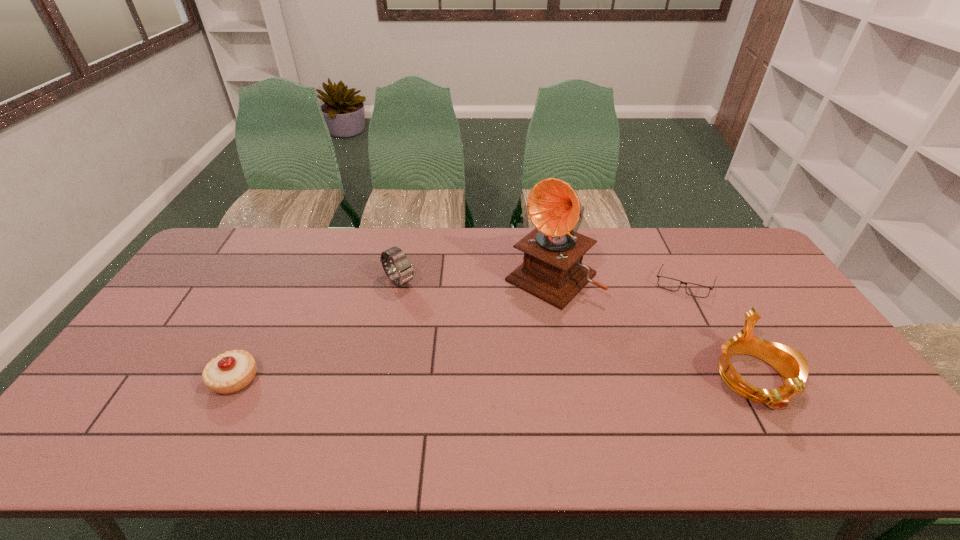
In order to click on vacant space on the desktop that is between the second shortest object and the tiara and is positioned on the horn of the phonograph record in this screenshot , I will do `click(444, 379)`.

Where is `free spot on the desktop that is between the pastry and the tiara and is positioned with the lenses facing outward on the spectacles`? free spot on the desktop that is between the pastry and the tiara and is positioned with the lenses facing outward on the spectacles is located at coordinates (506, 379).

Locate an element on the screen. This screenshot has height=540, width=960. vacant space on the desktop that is between the second shortest object and the tiara and is positioned on the face of the second object from left to right is located at coordinates (510, 379).